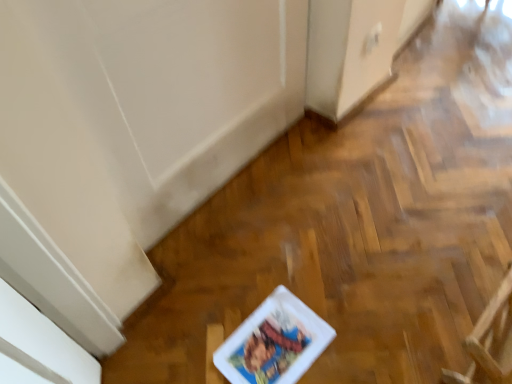
Question: Does white glossy comic book at center appear on the right side of wooden armchair at lower right?

Choices:
 (A) yes
 (B) no

Answer: (B)

Question: Are white glossy comic book at center and wooden armchair at lower right far apart?

Choices:
 (A) yes
 (B) no

Answer: (B)

Question: Is white glossy comic book at center oriented towards wooden armchair at lower right?

Choices:
 (A) yes
 (B) no

Answer: (B)

Question: Would you say white glossy comic book at center is outside wooden armchair at lower right?

Choices:
 (A) yes
 (B) no

Answer: (A)

Question: From a real-world perspective, is white glossy comic book at center located beneath wooden armchair at lower right?

Choices:
 (A) yes
 (B) no

Answer: (A)

Question: Considering the relative sizes of white glossy comic book at center and wooden armchair at lower right in the image provided, is white glossy comic book at center taller than wooden armchair at lower right?

Choices:
 (A) no
 (B) yes

Answer: (A)

Question: Considering the relative sizes of wooden armchair at lower right and white glossy comic book at center in the image provided, is wooden armchair at lower right bigger than white glossy comic book at center?

Choices:
 (A) yes
 (B) no

Answer: (A)

Question: From a real-world perspective, is wooden armchair at lower right located higher than white glossy comic book at center?

Choices:
 (A) yes
 (B) no

Answer: (A)

Question: Is wooden armchair at lower right to the left of white glossy comic book at center from the viewer's perspective?

Choices:
 (A) no
 (B) yes

Answer: (A)

Question: Is wooden armchair at lower right in front of white glossy comic book at center?

Choices:
 (A) no
 (B) yes

Answer: (B)

Question: Considering the relative sizes of wooden armchair at lower right and white glossy comic book at center in the image provided, is wooden armchair at lower right wider than white glossy comic book at center?

Choices:
 (A) no
 (B) yes

Answer: (A)

Question: From the image's perspective, is wooden armchair at lower right on white glossy comic book at center?

Choices:
 (A) no
 (B) yes

Answer: (B)

Question: From their relative heights in the image, would you say wooden armchair at lower right is taller or shorter than white glossy comic book at center?

Choices:
 (A) tall
 (B) short

Answer: (A)